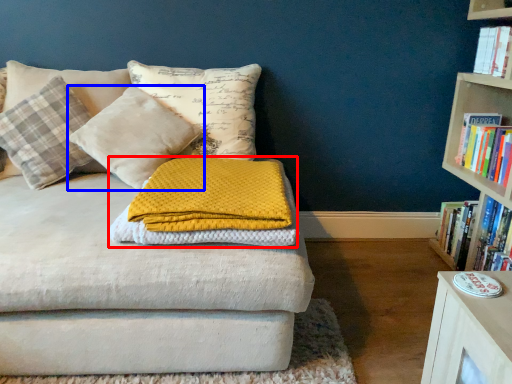
Question: Which of the following is the farthest to the observer, blanket (highlighted by a red box) or pillow (highlighted by a blue box)?

Choices:
 (A) blanket
 (B) pillow

Answer: (B)